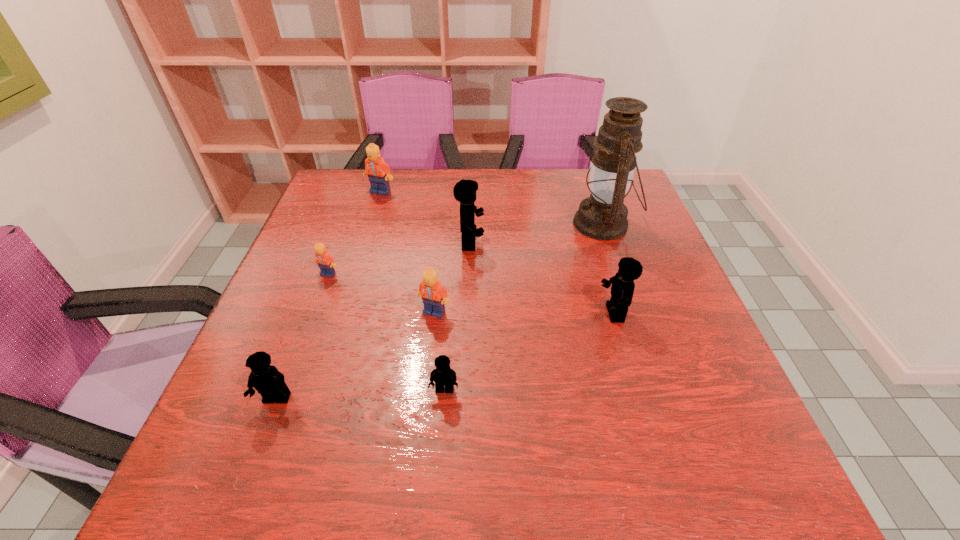
At what (x,y) coordinates should I click in order to perform the action: click on free space that is in between the nearest orange Lego and the second farthest orange Lego. Please return your answer as a coordinate pair (x, y). This screenshot has width=960, height=540. Looking at the image, I should click on (381, 293).

Identify the location of empty space that is in between the smallest yellow Lego and the oil lamp. (524, 307).

I want to click on free space between the oil lamp and the farthest orange Lego, so click(492, 208).

Select which object is the fourth closest to the rightmost orange Lego. Please provide its 2D coordinates. Your answer should be formatted as a tuple, i.e. [(x, y)], where the tuple contains the x and y coordinates of a point satisfying the conditions above.

[(267, 380)]

Locate which object is the fifth closest to the smallest yellow Lego. Please provide its 2D coordinates. Your answer should be formatted as a tuple, i.e. [(x, y)], where the tuple contains the x and y coordinates of a point satisfying the conditions above.

[(326, 263)]

I want to click on Lego that stands as the fifth closest to the smallest yellow Lego, so click(x=326, y=263).

Select which Lego appears as the closest to the farthest yellow Lego. Please provide its 2D coordinates. Your answer should be formatted as a tuple, i.e. [(x, y)], where the tuple contains the x and y coordinates of a point satisfying the conditions above.

[(434, 295)]

At what (x,y) coordinates should I click in order to perform the action: click on yellow Lego that is the nearest to the biggest orange Lego. Please return your answer as a coordinate pair (x, y). Looking at the image, I should click on (464, 191).

Identify which yellow Lego is the second nearest to the third biggest yellow Lego. Please provide its 2D coordinates. Your answer should be formatted as a tuple, i.e. [(x, y)], where the tuple contains the x and y coordinates of a point satisfying the conditions above.

[(464, 191)]

Image resolution: width=960 pixels, height=540 pixels. Identify the location of orange Lego that is the closest to the second farthest orange Lego. (434, 295).